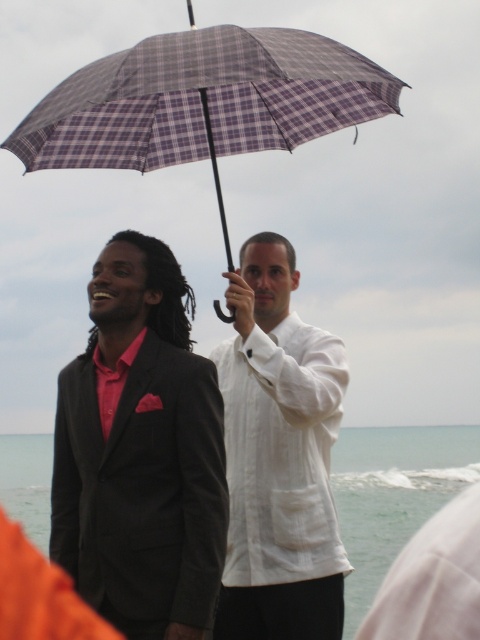
Question: Estimate the real-world distances between objects in this image. Which object is farther from the white linen shirt at center?

Choices:
 (A) plaid fabric umbrella at center
 (B) matte black suit at left

Answer: (A)

Question: Estimate the real-world distances between objects in this image. Which object is farther from the plaid fabric umbrella at center?

Choices:
 (A) matte black suit at left
 (B) white linen shirt at center

Answer: (B)

Question: From the image, what is the correct spatial relationship of white linen shirt at center in relation to plaid fabric umbrella at center?

Choices:
 (A) right
 (B) left

Answer: (A)

Question: Can you confirm if white linen shirt at center is smaller than plaid fabric umbrella at center?

Choices:
 (A) yes
 (B) no

Answer: (B)

Question: Can you confirm if white linen shirt at center is positioned to the left of plaid fabric umbrella at center?

Choices:
 (A) yes
 (B) no

Answer: (B)

Question: Which point is closer to the camera?

Choices:
 (A) plaid fabric umbrella at center
 (B) white linen shirt at center

Answer: (B)